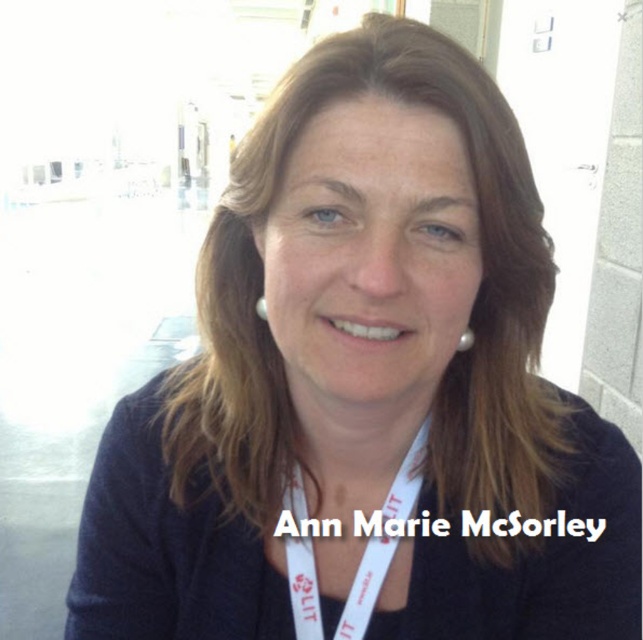
You are a photographer adjusting your camera settings to focus on the subject. You notice the skinsmoothneck at center and the pearlelegantearring at upper center. Which object should you focus on first if you want to ensure the closer one is sharp?

The skinsmoothneck at center is closer to the viewer than the pearlelegantearring at upper center, so you should focus on the skinsmoothneck at center first to ensure it is sharp.

The person in the image is wearing two pearl earrings. The pearlelegantearring at upper center and the pearl earring at upper center. Which one is larger?

The pearlelegantearring at upper center is bigger than the pearl earring at upper center.

You are a photographer adjusting your camera settings to capture the best shot of the subject. You notice the white fabric lanyard at center and the pearlelegantearring at upper center. Which object should you focus on first to ensure it is in sharp focus, considering their positions?

The white fabric lanyard at center is much taller than the pearlelegantearring at upper center, so you should focus on the white fabric lanyard at center first because it is closer to the camera and more prominent in the frame.